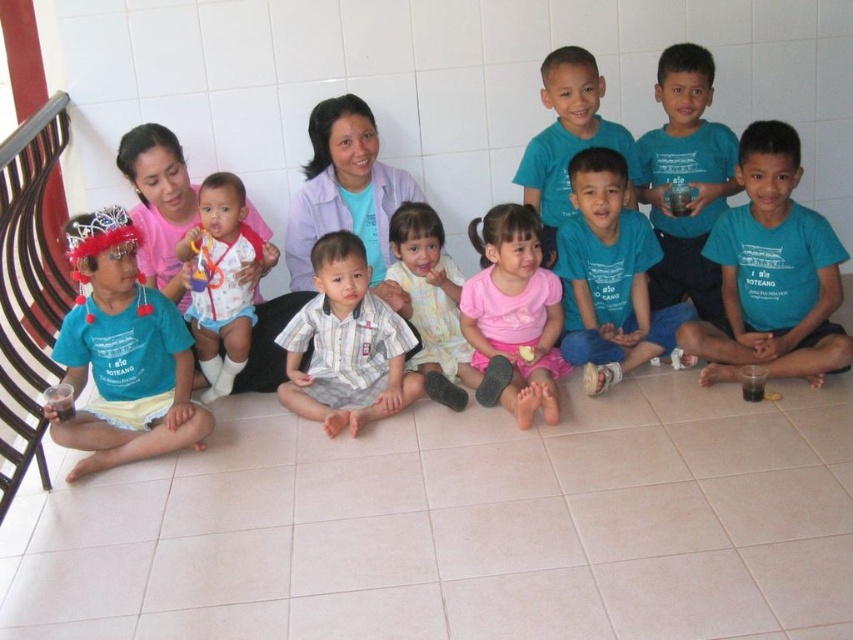
Question: Based on their relative distances, which object is nearer to the blue cotton shirt at center?

Choices:
 (A) teal matte shirt at center
 (B) white cloth baby at center
 (C) pink fabric dress at center
 (D) striped cotton shirt at center

Answer: (C)

Question: Estimate the real-world distances between objects in this image. Which object is closer to the blue cotton shirt at center?

Choices:
 (A) matte blue shirt at left
 (B) matte blue shirt at center
 (C) white cloth baby at center
 (D) striped cotton shirt at center

Answer: (B)

Question: Does striped cotton shirt at center appear under matte blue shirt at center?

Choices:
 (A) no
 (B) yes

Answer: (B)

Question: Can you confirm if striped cotton shirt at center is wider than teal matte shirt at center?

Choices:
 (A) no
 (B) yes

Answer: (B)

Question: Which point is farther to the camera?

Choices:
 (A) blue cotton shirt at right
 (B) matte blue shirt at left

Answer: (A)

Question: Does matte blue shirt at left lie in front of matte blue shirt at center?

Choices:
 (A) yes
 (B) no

Answer: (A)